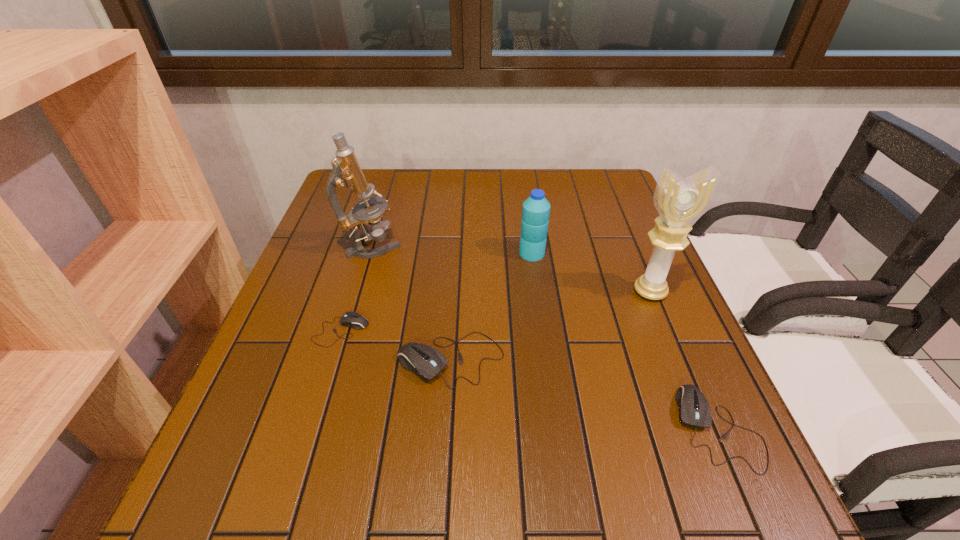
At what (x,y) coordinates should I click in order to perform the action: click on free space located on the left of the second computer mouse from right to left. Please return your answer as a coordinate pair (x, y). This screenshot has height=540, width=960. Looking at the image, I should click on (259, 359).

In order to click on vacant space situated 0.220m on the back of the second shortest object in this screenshot , I will do `click(665, 305)`.

Locate an element on the screen. vacant space located on the back of the water bottle is located at coordinates (521, 179).

I want to click on free region located 0.280m on the right of the microscope, so click(x=506, y=246).

Where is `vacant space located on the front-facing side of the award`? The height and width of the screenshot is (540, 960). vacant space located on the front-facing side of the award is located at coordinates (678, 360).

This screenshot has height=540, width=960. I want to click on object situated at the near edge, so click(x=694, y=410).

Where is `computer mouse at the left edge`? The height and width of the screenshot is (540, 960). computer mouse at the left edge is located at coordinates pos(351,319).

Where is `microscope positioned at the left edge`? microscope positioned at the left edge is located at coordinates (346, 172).

Where is `computer mouse that is positioned at the right edge`? This screenshot has height=540, width=960. computer mouse that is positioned at the right edge is located at coordinates (694, 410).

This screenshot has height=540, width=960. In order to click on award that is at the right edge in this screenshot , I will do `click(679, 201)`.